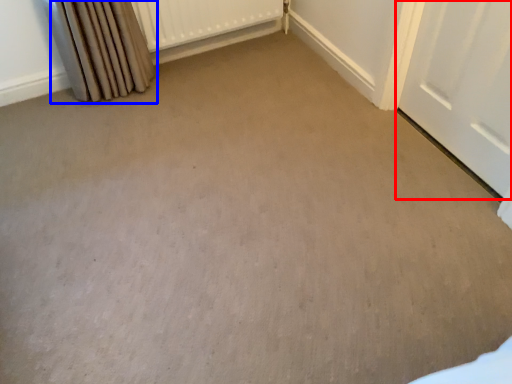
Question: Which point is closer to the camera, door (highlighted by a red box) or curtain (highlighted by a blue box)?

Choices:
 (A) door
 (B) curtain

Answer: (A)